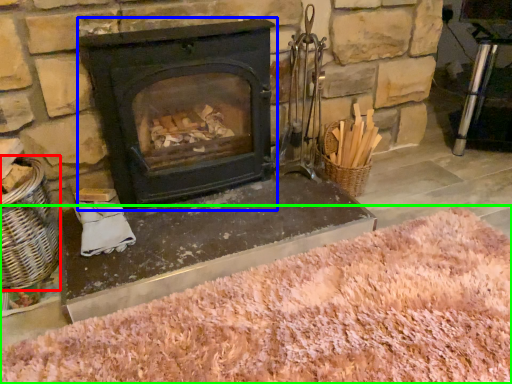
Question: Which object is positioned closest to basket (highlighted by a red box)? Select from wood burning stove (highlighted by a blue box) and sand (highlighted by a green box).

Choices:
 (A) wood burning stove
 (B) sand

Answer: (A)